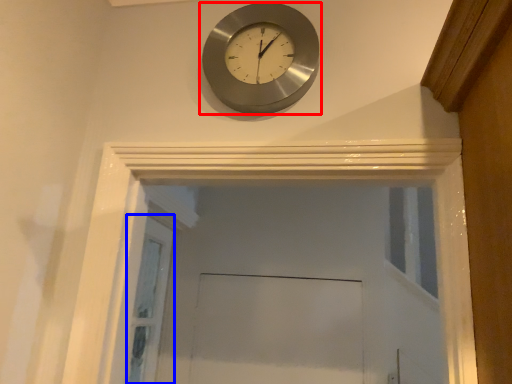
Question: Which point is further to the camera, wall clock (highlighted by a red box) or screen door (highlighted by a blue box)?

Choices:
 (A) wall clock
 (B) screen door

Answer: (B)